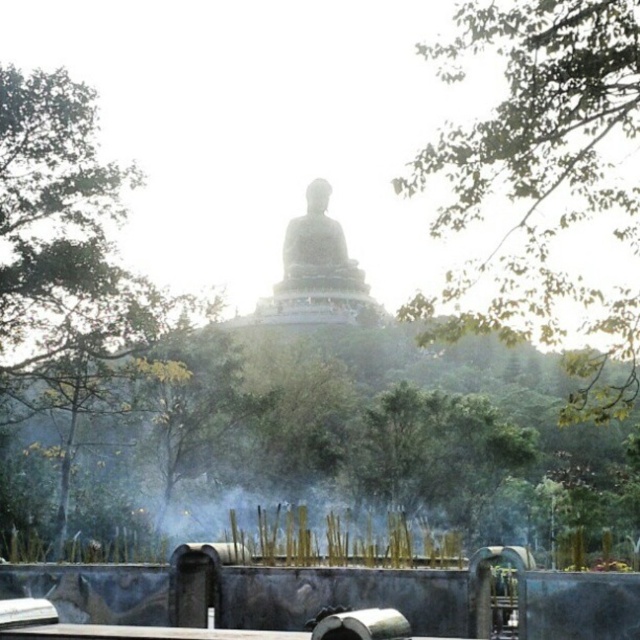
Question: Which of the following is the closest to the observer?

Choices:
 (A) (284, 252)
 (B) (29, 173)

Answer: (B)

Question: Among these objects, which one is nearest to the camera?

Choices:
 (A) white marble statue at center
 (B) green leafy tree at upper right
 (C) green leafy tree at left

Answer: (B)

Question: Is green leafy tree at left to the right of white marble statue at center from the viewer's perspective?

Choices:
 (A) no
 (B) yes

Answer: (A)

Question: Is green leafy tree at upper right below green leafy tree at left?

Choices:
 (A) yes
 (B) no

Answer: (B)

Question: Is green leafy tree at left smaller than white marble statue at center?

Choices:
 (A) yes
 (B) no

Answer: (B)

Question: Which of the following is the farthest from the observer?

Choices:
 (A) (602, 186)
 (B) (324, 250)
 (C) (68, 333)

Answer: (B)